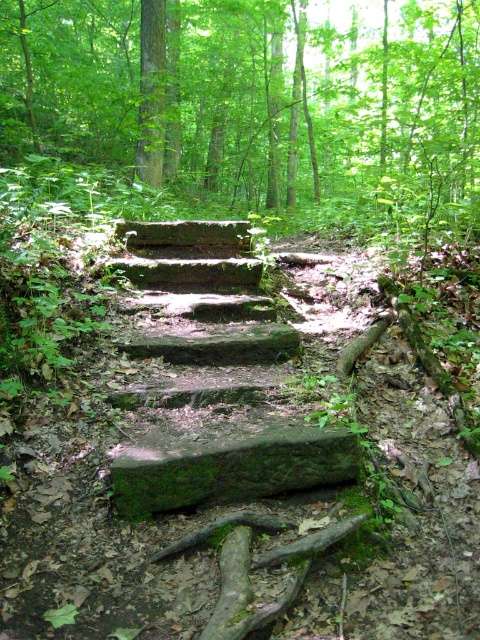
Question: Does green mossy stone stairs at center have a lesser width compared to green mossy stone at center?

Choices:
 (A) yes
 (B) no

Answer: (B)

Question: Does green mossy stone stairs at center have a lesser width compared to green mossy stone at center?

Choices:
 (A) yes
 (B) no

Answer: (B)

Question: Which point is farther to the camera?

Choices:
 (A) (180, 333)
 (B) (123, 452)

Answer: (A)

Question: Is green mossy stone steps at center in front of green mossy stone at center?

Choices:
 (A) no
 (B) yes

Answer: (A)

Question: Which object appears farthest from the camera in this image?

Choices:
 (A) green mossy stone steps at center
 (B) green mossy stone stairs at center

Answer: (A)

Question: Which object appears farthest from the camera in this image?

Choices:
 (A) green mossy stone stairs at center
 (B) green mossy stone at center
 (C) green mossy stone steps at center

Answer: (C)